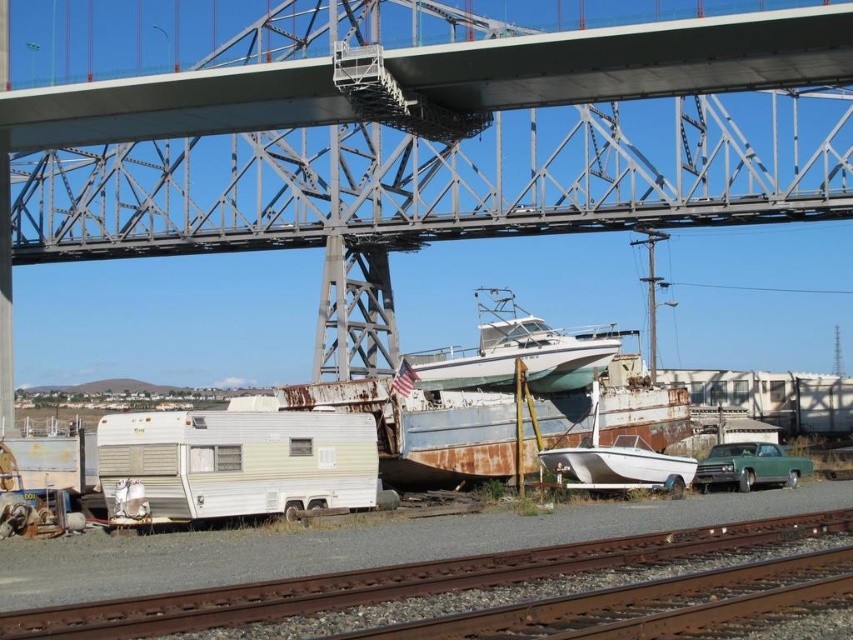
Is metallic gray bridge at upper center bigger than white matte boat at center?

Yes, metallic gray bridge at upper center is bigger than white matte boat at center.

Who is positioned more to the right, metallic gray bridge at upper center or white matte boat at center?

Positioned to the right is white matte boat at center.

This screenshot has height=640, width=853. What do you see at coordinates (428, 145) in the screenshot? I see `metallic gray bridge at upper center` at bounding box center [428, 145].

The image size is (853, 640). What are the coordinates of `metallic gray bridge at upper center` in the screenshot? It's located at (428, 145).

You are a GUI agent. You are given a task and a screenshot of the screen. Output one action in this format:
    pyautogui.click(x=<x>, y=<y>)
    Task: Click on the metallic gray bridge at upper center
    The image size is (853, 640).
    Given the screenshot: What is the action you would take?
    pyautogui.click(x=428, y=145)

This screenshot has height=640, width=853. In order to click on metallic gray bridge at upper center in this screenshot , I will do 428,145.

Is white glossy boat at center closer to camera compared to green matte car at lower right?

No, white glossy boat at center is further to the viewer.

Can you confirm if white glossy boat at center is positioned below green matte car at lower right?

No, white glossy boat at center is not below green matte car at lower right.

Is point (483, 332) farther from viewer compared to point (762, 445)?

That is True.

At what (x,y) coordinates should I click in order to perform the action: click on white glossy boat at center. Please return your answer as a coordinate pair (x, y). The width and height of the screenshot is (853, 640). Looking at the image, I should click on (514, 353).